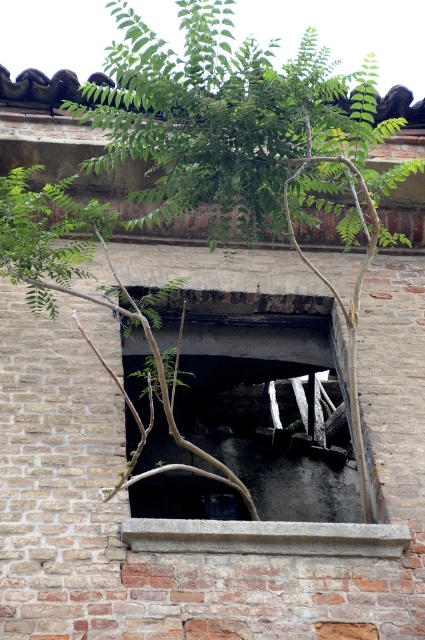
Question: Which point is closer to the camera?

Choices:
 (A) (255, 436)
 (B) (150, 525)

Answer: (B)

Question: Observing the image, what is the correct spatial positioning of charcoal ash hole at center in reference to gray concrete ledge at center?

Choices:
 (A) above
 (B) below

Answer: (A)

Question: Which point appears closest to the camera in this image?

Choices:
 (A) (334, 490)
 (B) (323, 540)

Answer: (B)

Question: Can you confirm if charcoal ash hole at center is positioned above gray concrete ledge at center?

Choices:
 (A) yes
 (B) no

Answer: (A)

Question: Does charcoal ash hole at center appear over gray concrete ledge at center?

Choices:
 (A) no
 (B) yes

Answer: (B)

Question: Among these objects, which one is nearest to the camera?

Choices:
 (A) charcoal ash hole at center
 (B) gray concrete ledge at center

Answer: (B)